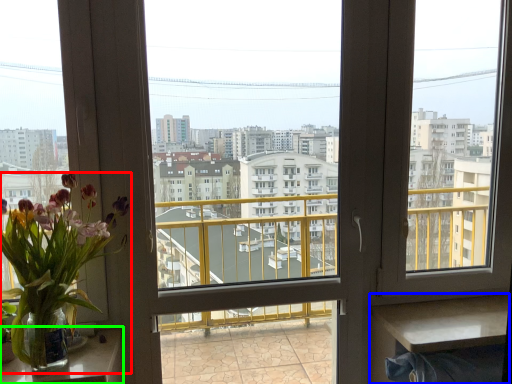
Question: Based on their relative distances, which object is nearer to houseplant (highlighted by a red box)? Choose from table (highlighted by a blue box) and table (highlighted by a green box).

Choices:
 (A) table
 (B) table

Answer: (B)